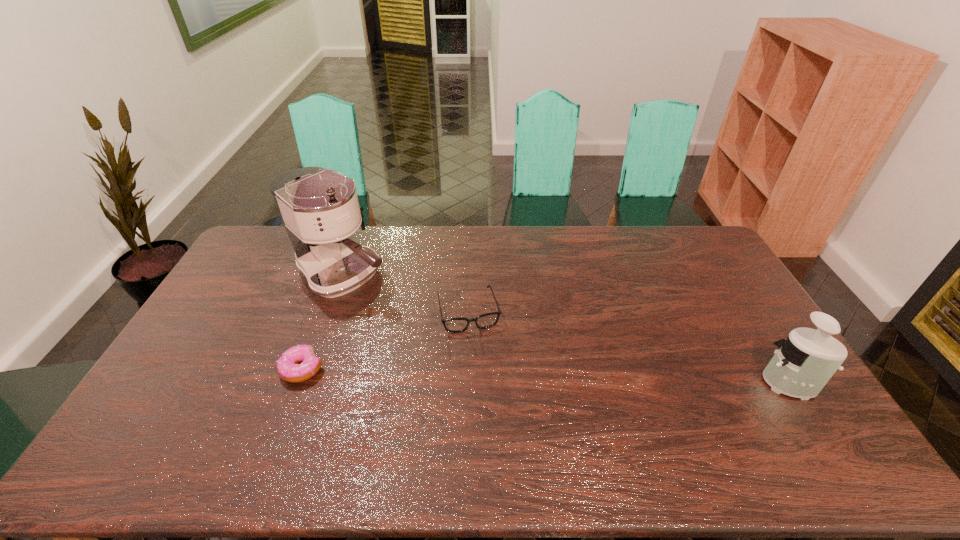
Where is `the shortest object`? Image resolution: width=960 pixels, height=540 pixels. the shortest object is located at coordinates (288, 369).

What are the coordinates of `juicer` in the screenshot? It's located at (804, 363).

Identify the location of the rightmost object. The image size is (960, 540). (804, 363).

Where is `the tallest object`? the tallest object is located at coordinates (319, 208).

Locate an element on the screen. the second object from right to left is located at coordinates (454, 325).

Locate an element on the screen. spectacles is located at coordinates (454, 325).

Find the location of `vacant space located 0.340m on the back of the shortest object`. vacant space located 0.340m on the back of the shortest object is located at coordinates (336, 278).

Where is `vacant point located 0.170m on the left of the rightmost object`? vacant point located 0.170m on the left of the rightmost object is located at coordinates (696, 381).

Where is `free spot located 0.160m on the front-facing side of the tallest object`? free spot located 0.160m on the front-facing side of the tallest object is located at coordinates (410, 318).

You are a GUI agent. You are given a task and a screenshot of the screen. Output one action in this format:
    pyautogui.click(x=<x>, y=<y>)
    Task: Click on the blank area located on the front-facing side of the tallest object
    
    Given the screenshot: What is the action you would take?
    pyautogui.click(x=434, y=334)